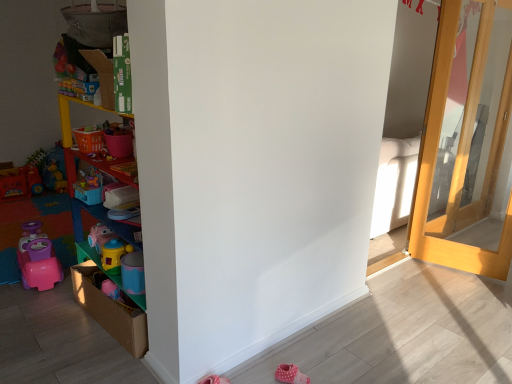
Question: Is multicolored plastic shelves at left behind pink fabric shoe at lower right?

Choices:
 (A) no
 (B) yes

Answer: (A)

Question: From the image's perspective, is multicolored plastic shelves at left over pink fabric shoe at lower right?

Choices:
 (A) no
 (B) yes

Answer: (B)

Question: From a real-world perspective, is multicolored plastic shelves at left under pink fabric shoe at lower right?

Choices:
 (A) yes
 (B) no

Answer: (B)

Question: Does multicolored plastic shelves at left come in front of pink fabric shoe at lower right?

Choices:
 (A) yes
 (B) no

Answer: (A)

Question: Does multicolored plastic shelves at left have a greater height compared to pink fabric shoe at lower right?

Choices:
 (A) yes
 (B) no

Answer: (A)

Question: Could you tell me if multicolored plastic shelves at left is turned towards pink fabric shoe at lower right?

Choices:
 (A) yes
 (B) no

Answer: (B)

Question: Could pink fabric shoe at lower right be considered to be inside light wood door at right?

Choices:
 (A) yes
 (B) no

Answer: (B)

Question: Does light wood door at right have a lesser width compared to pink fabric shoe at lower right?

Choices:
 (A) yes
 (B) no

Answer: (A)

Question: Is light wood door at right positioned behind pink fabric shoe at lower right?

Choices:
 (A) no
 (B) yes

Answer: (B)

Question: Considering the relative sizes of light wood door at right and pink fabric shoe at lower right in the image provided, is light wood door at right taller than pink fabric shoe at lower right?

Choices:
 (A) yes
 (B) no

Answer: (A)

Question: Does light wood door at right lie in front of pink fabric shoe at lower right?

Choices:
 (A) yes
 (B) no

Answer: (B)

Question: From a real-world perspective, is light wood door at right under pink fabric shoe at lower right?

Choices:
 (A) yes
 (B) no

Answer: (B)

Question: Is light wood door at right bigger than multicolored plastic shelves at left?

Choices:
 (A) no
 (B) yes

Answer: (B)